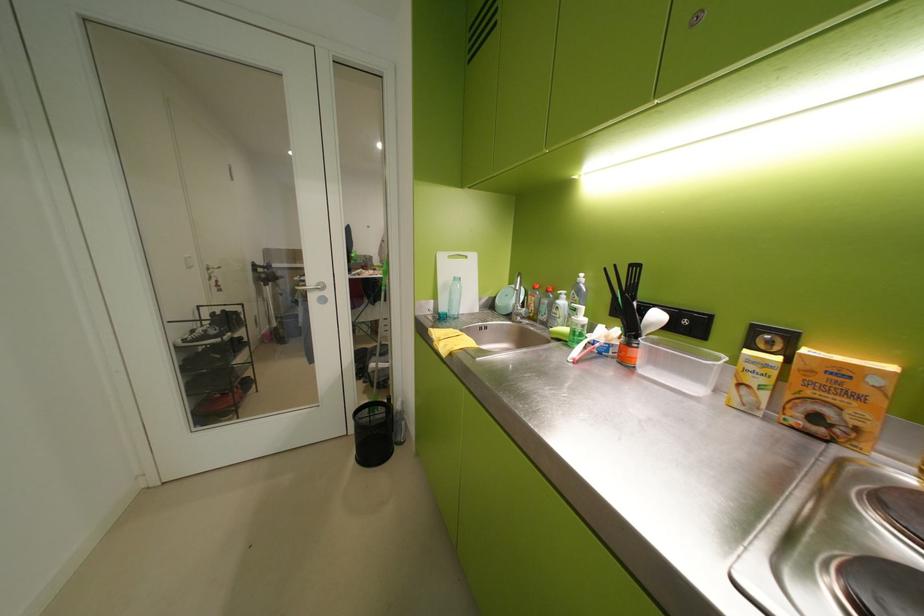
Where would you turn the metal faucet handle? Please return your answer as a coordinate pair (x, y).

(527, 306)